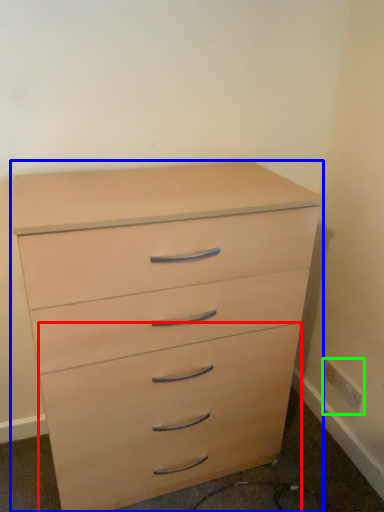
Question: Which object is the farthest from drawer (highlighted by a red box)? Choose among these: chest of drawers (highlighted by a blue box) or electric outlet (highlighted by a green box).

Choices:
 (A) chest of drawers
 (B) electric outlet

Answer: (B)